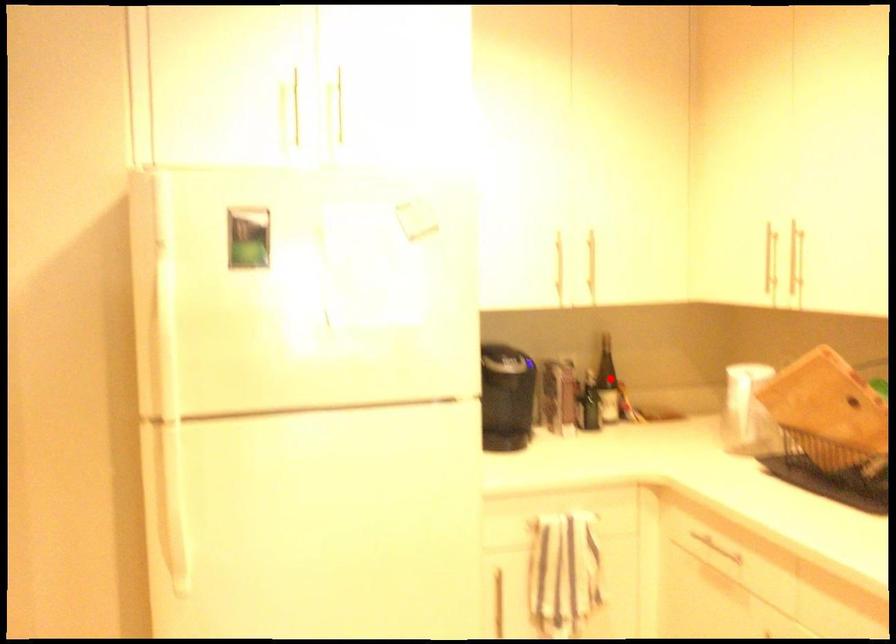
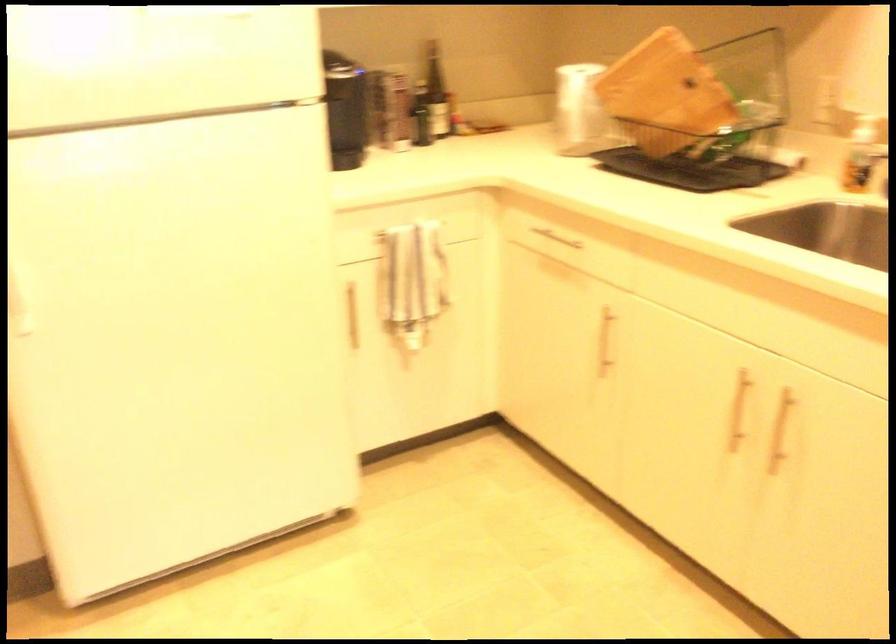
Question: I am providing you with two images of the same scene from different viewpoints. A red point is marked on the first image. Is the red point's position out of view in image 2?

Choices:
 (A) Yes
 (B) No

Answer: (B)